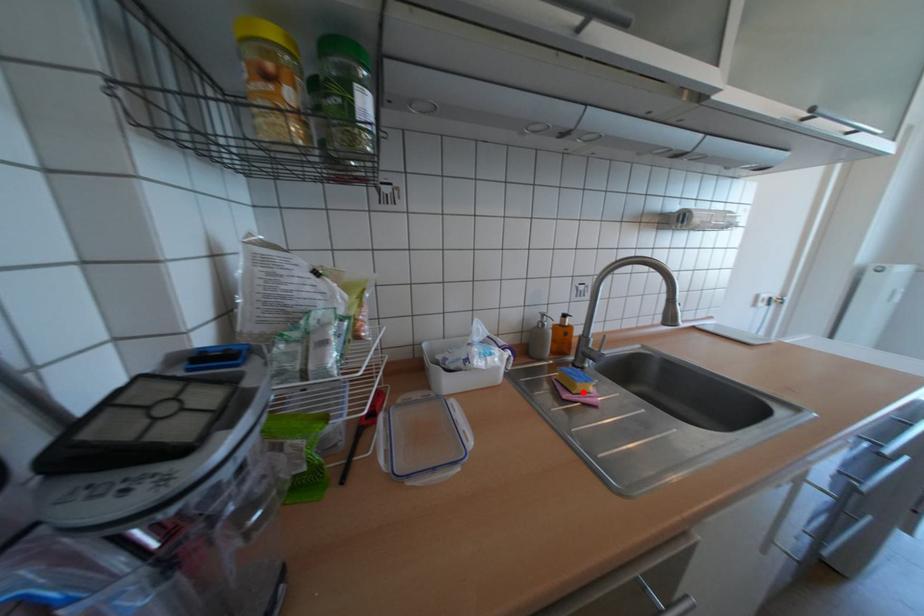
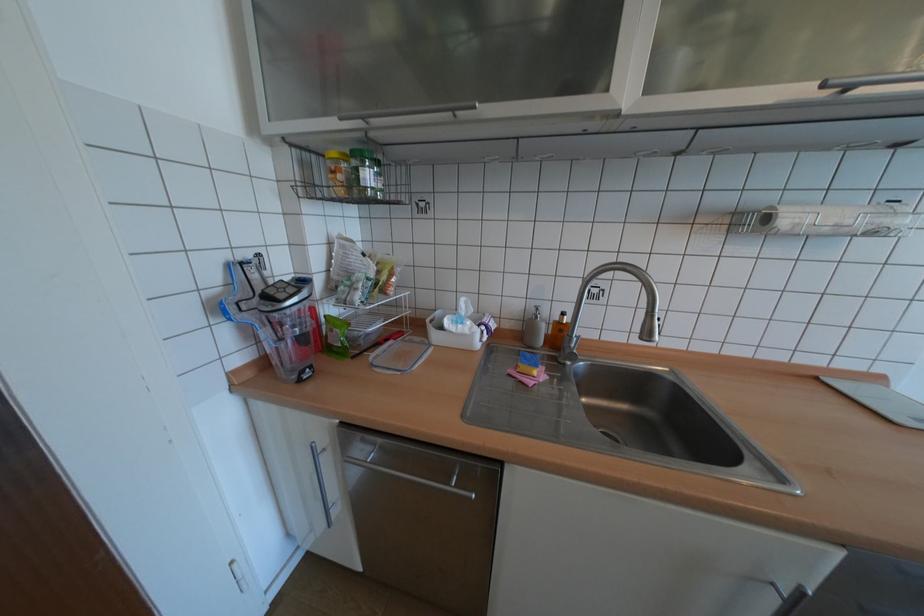
Find the pixel in the second image that matches the highlighted location in the first image.

(527, 371)